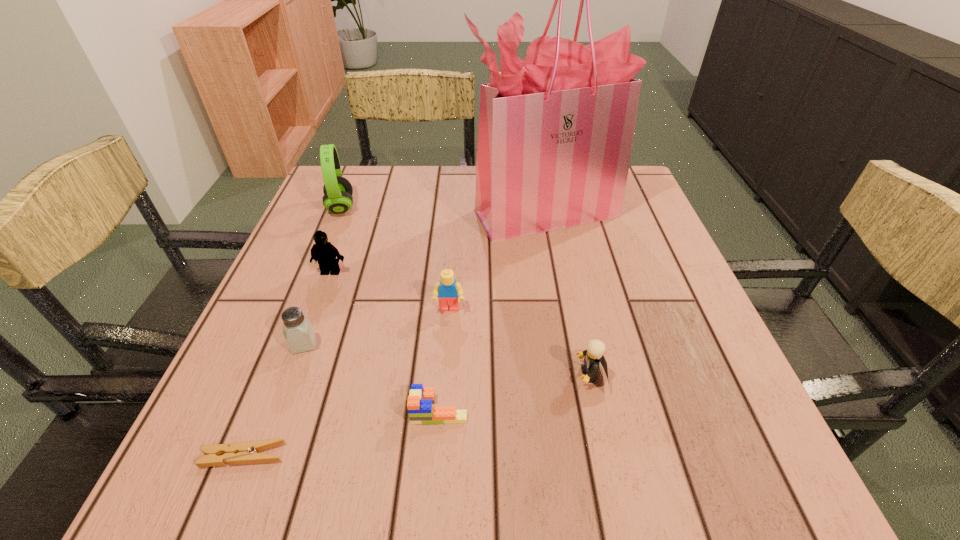
Find the location of a particular element. This screenshot has height=540, width=960. object that is at the far right corner is located at coordinates (555, 135).

In the image, there is a desktop. Identify the location of vacant area at the far edge. (437, 202).

Find the location of `free space at the left edge of the desktop`. free space at the left edge of the desktop is located at coordinates (348, 214).

In the image, there is a desktop. At what (x,y) coordinates should I click in order to perform the action: click on vacant space at the right edge. Please return your answer as a coordinate pair (x, y). The image size is (960, 540). Looking at the image, I should click on (609, 245).

The height and width of the screenshot is (540, 960). I want to click on free space at the far left corner of the desktop, so click(x=359, y=179).

Identify the location of free space between the tallest object and the third nearest Lego. The width and height of the screenshot is (960, 540). (496, 261).

I want to click on vacant space that is in between the fifth nearest object and the saltshaker, so click(x=376, y=327).

The image size is (960, 540). I want to click on vacant point located between the fourth farthest object and the shortest Lego, so click(444, 359).

Identify the location of free space that is in between the seventh shortest object and the fifth nearest object. (395, 258).

Identify the location of free space between the shortest Lego and the saltshaker. (372, 376).